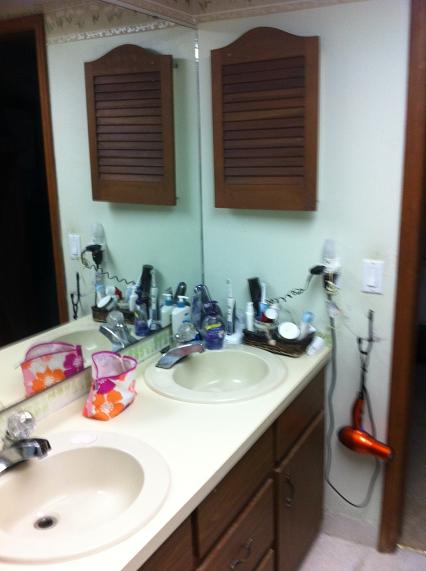
The height and width of the screenshot is (571, 426). I want to click on cabinet door, so click(315, 484).